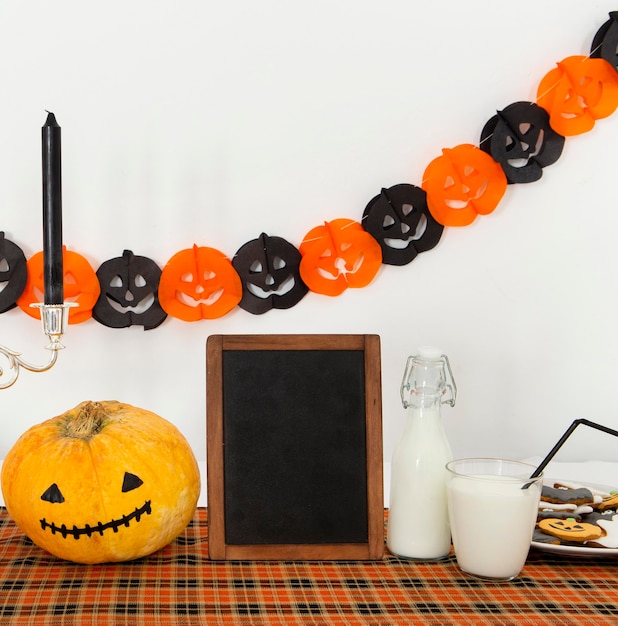
Find the location of a particular element. The width and height of the screenshot is (618, 626). plate is located at coordinates (564, 550).